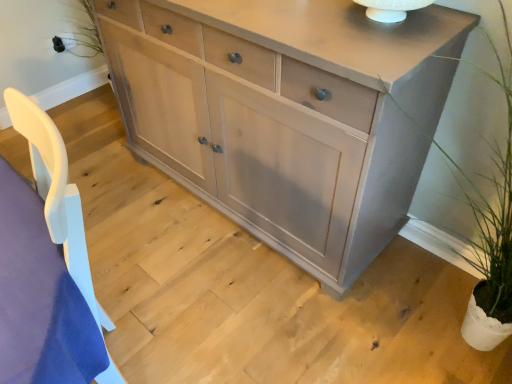
Question: Is matte gray cabinet at center positioned behind green leafy plant at right?

Choices:
 (A) no
 (B) yes

Answer: (B)

Question: Considering the relative positions of matte gray cabinet at center and green leafy plant at right in the image provided, is matte gray cabinet at center to the right of green leafy plant at right from the viewer's perspective?

Choices:
 (A) yes
 (B) no

Answer: (B)

Question: Is matte gray cabinet at center facing away from green leafy plant at right?

Choices:
 (A) yes
 (B) no

Answer: (B)

Question: Does matte gray cabinet at center turn towards green leafy plant at right?

Choices:
 (A) yes
 (B) no

Answer: (B)

Question: From the image's perspective, is matte gray cabinet at center located beneath green leafy plant at right?

Choices:
 (A) no
 (B) yes

Answer: (A)

Question: From a real-world perspective, is matte gray cabinet at center physically above green leafy plant at right?

Choices:
 (A) no
 (B) yes

Answer: (A)

Question: Considering the relative positions of green leafy plant at right and matte gray cabinet at center in the image provided, is green leafy plant at right to the left of matte gray cabinet at center from the viewer's perspective?

Choices:
 (A) yes
 (B) no

Answer: (B)

Question: Is green leafy plant at right oriented away from matte gray cabinet at center?

Choices:
 (A) yes
 (B) no

Answer: (B)

Question: Are green leafy plant at right and matte gray cabinet at center located far from each other?

Choices:
 (A) no
 (B) yes

Answer: (A)

Question: Is green leafy plant at right bigger than matte gray cabinet at center?

Choices:
 (A) yes
 (B) no

Answer: (B)

Question: Does green leafy plant at right lie in front of matte gray cabinet at center?

Choices:
 (A) yes
 (B) no

Answer: (A)

Question: Is green leafy plant at right smaller than matte gray cabinet at center?

Choices:
 (A) yes
 (B) no

Answer: (A)

Question: Based on their positions, is green leafy plant at right located to the left or right of matte gray cabinet at center?

Choices:
 (A) right
 (B) left

Answer: (A)